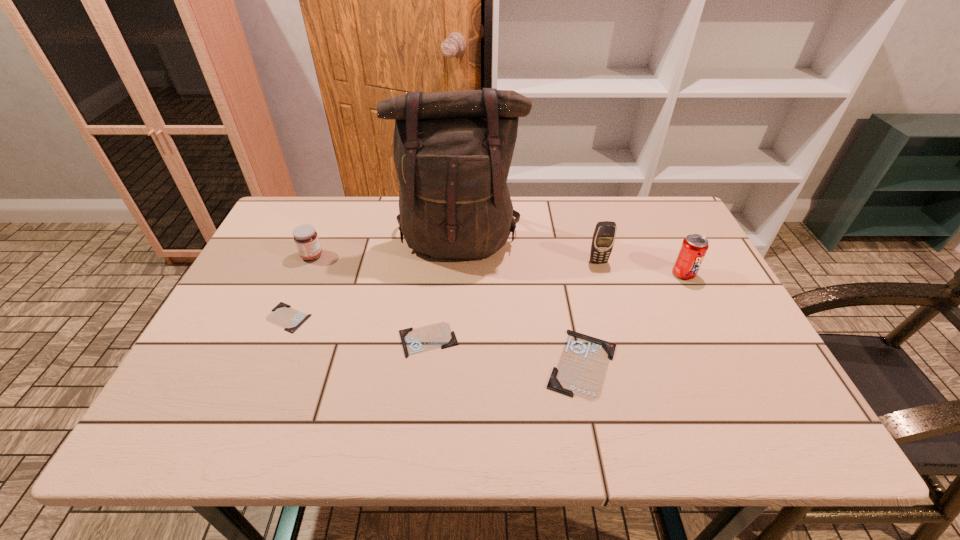
You are a GUI agent. You are given a task and a screenshot of the screen. Output one action in this format:
    pyautogui.click(x=<x>, y=<y>)
    Task: Click on the identity card that stands as the closest to the jam
    The height and width of the screenshot is (540, 960).
    Given the screenshot: What is the action you would take?
    coord(283,315)

Find the location of a particular element. The width and height of the screenshot is (960, 540). the second closest identity card to the fifth shortest object is located at coordinates (439, 335).

In order to click on free location that satisfies the following two spatial constraints: 1. on the front face of the rightmost object; 2. on the left side of the cellular telephone in this screenshot , I will do `click(602, 274)`.

Find the location of a particular element. vacant space that satisfies the following two spatial constraints: 1. on the front side of the shortest identity card; 2. on the left side of the rightmost identity card is located at coordinates (269, 363).

Image resolution: width=960 pixels, height=540 pixels. What are the coordinates of `free point that satisfies the following two spatial constraints: 1. on the back side of the rightmost identity card; 2. on the left side of the soda can` in the screenshot? It's located at (564, 274).

Where is `vacant space that satisfies the following two spatial constraints: 1. on the front side of the second shortest identity card; 2. on the left side of the rightmost identity card`? The height and width of the screenshot is (540, 960). vacant space that satisfies the following two spatial constraints: 1. on the front side of the second shortest identity card; 2. on the left side of the rightmost identity card is located at coordinates (425, 363).